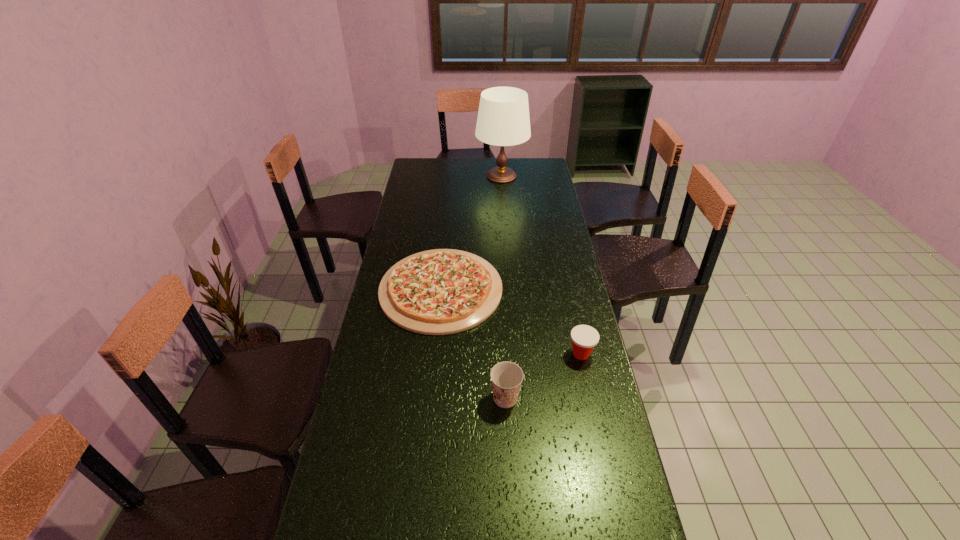
Where is `free point between the second nearest object and the nearest object`? The width and height of the screenshot is (960, 540). free point between the second nearest object and the nearest object is located at coordinates (543, 376).

Where is `free space that is in between the pizza and the nearer Dixie cup`? The image size is (960, 540). free space that is in between the pizza and the nearer Dixie cup is located at coordinates (473, 343).

Where is `free space between the shorter Dixie cup and the shortest object`? free space between the shorter Dixie cup and the shortest object is located at coordinates (511, 322).

Where is `free space between the third nearest object and the rightmost object`? This screenshot has height=540, width=960. free space between the third nearest object and the rightmost object is located at coordinates point(511,322).

This screenshot has height=540, width=960. In order to click on vacant space in between the pizza and the right Dixie cup in this screenshot , I will do (x=511, y=322).

This screenshot has width=960, height=540. Find the location of `vacant area that lies between the second farthest object and the lamp`. vacant area that lies between the second farthest object and the lamp is located at coordinates (471, 233).

Image resolution: width=960 pixels, height=540 pixels. Find the location of `vacant area between the third nearest object and the lamp`. vacant area between the third nearest object and the lamp is located at coordinates (471, 233).

Image resolution: width=960 pixels, height=540 pixels. Find the location of `empty space between the pizza and the nearest object`. empty space between the pizza and the nearest object is located at coordinates click(473, 343).

The height and width of the screenshot is (540, 960). Find the location of `vacant space in between the tallest object and the second nearest object`. vacant space in between the tallest object and the second nearest object is located at coordinates (541, 265).

Where is `free space between the tallest object and the nearer Dixie cup`? The height and width of the screenshot is (540, 960). free space between the tallest object and the nearer Dixie cup is located at coordinates (503, 287).